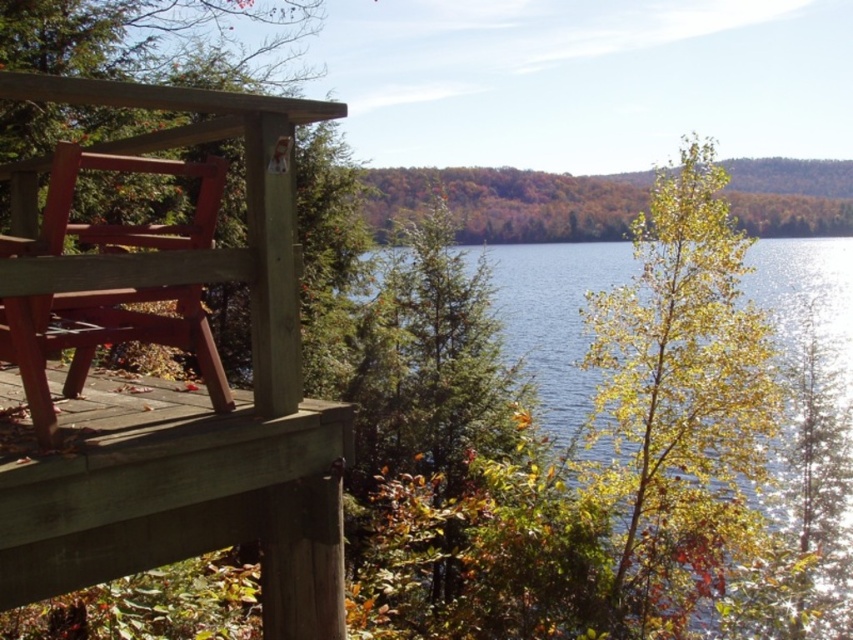
You are a painter standing on the wooden deck and want to place a 10 inch wide canvas between the wooden bench at left and the matte red park bench at left. Can you fit it there?

The wooden bench at left is 8.76 inches away from matte red park bench at left, so the 10 inch wide canvas cannot fit between them as the space is smaller than the canvas.

You are a painter standing on the wooden deck at lower left and want to place your easel near the matte red park bench at left to capture the autumn scene. Can you fit your 12 inch wide easel between them without moving either object?

The wooden deck at lower left and the matte red park bench at left are 13.89 inches apart. Since your 12 inch wide easel is narrower than the 13.89 inch space between them, you can fit it there without moving either object.